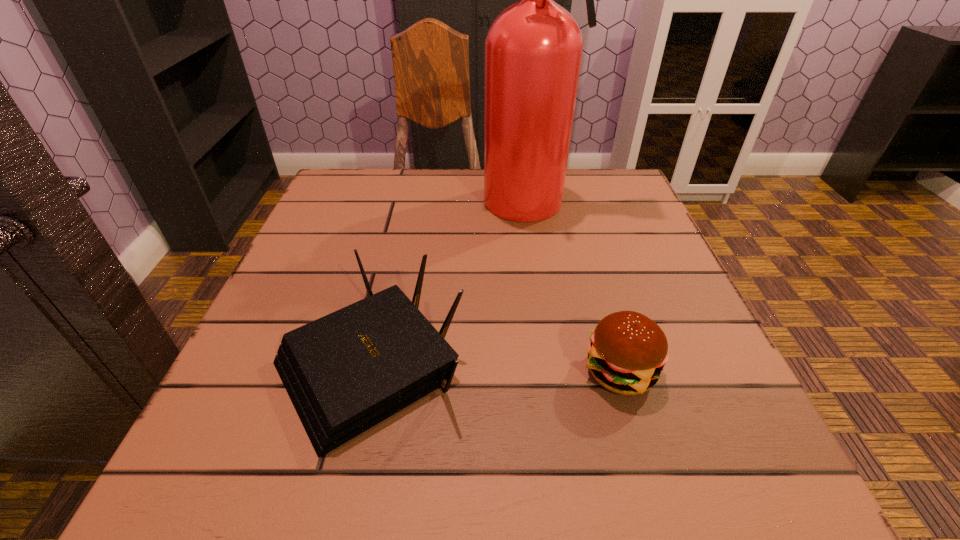
At what (x,y) coordinates should I click in order to perform the action: click on empty location between the fire extinguisher and the hamburger. Please return your answer as a coordinate pair (x, y). Looking at the image, I should click on (579, 287).

I want to click on unoccupied area between the fire extinguisher and the leftmost object, so click(453, 284).

This screenshot has width=960, height=540. In order to click on unoccupied area between the hamburger and the farthest object in this screenshot , I will do `click(579, 287)`.

Identify which object is the closest to the leftmost object. Please provide its 2D coordinates. Your answer should be formatted as a tuple, i.e. [(x, y)], where the tuple contains the x and y coordinates of a point satisfying the conditions above.

[(628, 351)]

The height and width of the screenshot is (540, 960). I want to click on object identified as the second closest to the leftmost object, so click(533, 50).

Locate an element on the screen. The height and width of the screenshot is (540, 960). free space that satisfies the following two spatial constraints: 1. on the front side of the shortest object; 2. on the right side of the tallest object is located at coordinates 569,372.

Identify the location of blank area in the image that satisfies the following two spatial constraints: 1. on the front side of the second tallest object; 2. on the left side of the hamburger. (367, 372).

Identify the location of free space that satisfies the following two spatial constraints: 1. on the front side of the second tallest object; 2. on the left side of the hamburger. This screenshot has height=540, width=960. (367, 372).

Locate an element on the screen. This screenshot has width=960, height=540. free region that satisfies the following two spatial constraints: 1. on the front side of the leftmost object; 2. on the left side of the shortest object is located at coordinates (367, 372).